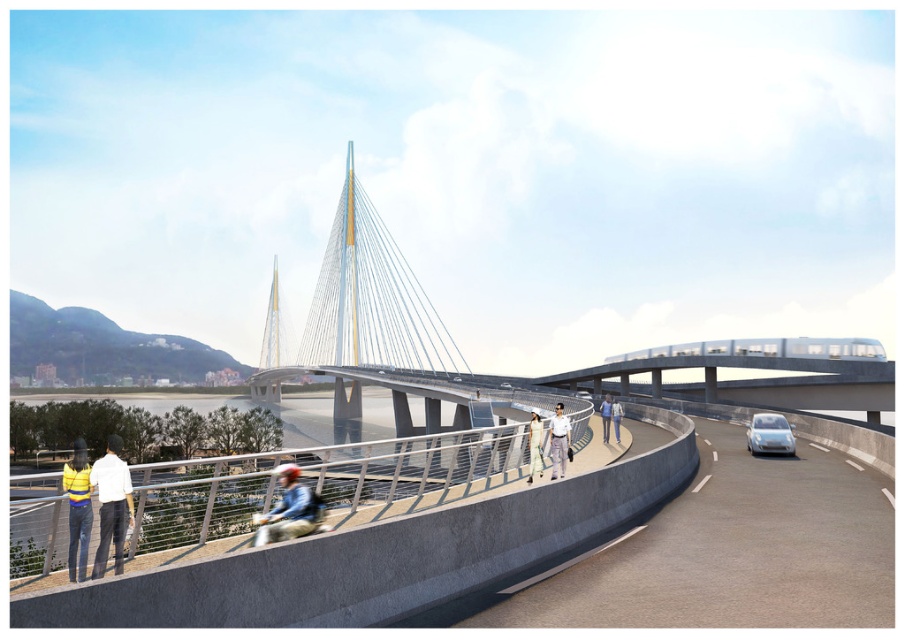
Question: Does blue denim skateboard at center have a greater width compared to yellow fabric jacket at lower left?

Choices:
 (A) yes
 (B) no

Answer: (B)

Question: Which object is positioned closest to the light beige fabric dress at center?

Choices:
 (A) yellow fabric jacket at lower left
 (B) white cotton shirt at lower left

Answer: (A)

Question: Which point appears farthest from the camera in this image?

Choices:
 (A) (529, 474)
 (B) (560, 458)
 (C) (772, 419)

Answer: (C)

Question: Can you confirm if yellow fabric jacket at lower left is smaller than white uniformed person at center?

Choices:
 (A) yes
 (B) no

Answer: (B)

Question: Which object appears closest to the camera in this image?

Choices:
 (A) metallic gray railing at lower left
 (B) light blue jeans at center
 (C) silver metallic car at right

Answer: (A)

Question: Is white cable-stayed bridge at center positioned behind light blue jeans at center?

Choices:
 (A) no
 (B) yes

Answer: (A)